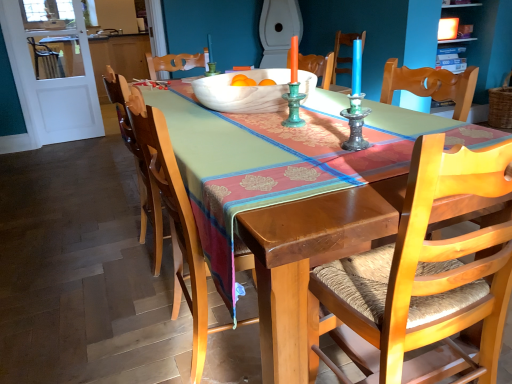
Question: Is white marble bowl at center at the back of white glossy toilet at upper center?

Choices:
 (A) yes
 (B) no

Answer: (B)

Question: Is white glossy toilet at upper center bigger than white marble bowl at center?

Choices:
 (A) yes
 (B) no

Answer: (A)

Question: From a real-world perspective, does white glossy toilet at upper center stand above white marble bowl at center?

Choices:
 (A) no
 (B) yes

Answer: (B)

Question: From the image's perspective, does white glossy toilet at upper center appear higher than white marble bowl at center?

Choices:
 (A) no
 (B) yes

Answer: (B)

Question: Considering the relative sizes of white glossy toilet at upper center and white marble bowl at center in the image provided, is white glossy toilet at upper center shorter than white marble bowl at center?

Choices:
 (A) yes
 (B) no

Answer: (B)

Question: From their relative heights in the image, would you say wooden chair with woven seat at center, which ranks as the first chair in left-to-right order, is taller or shorter than white marble bowl at center?

Choices:
 (A) short
 (B) tall

Answer: (B)

Question: From a real-world perspective, relative to white marble bowl at center, is wooden chair with woven seat at center, which ranks as the first chair in left-to-right order, vertically above or below?

Choices:
 (A) below
 (B) above

Answer: (A)

Question: Is wooden chair with woven seat at center, which ranks as the first chair in left-to-right order, inside the boundaries of white marble bowl at center, or outside?

Choices:
 (A) inside
 (B) outside

Answer: (B)

Question: Looking at the image, does wooden chair with woven seat at center, which ranks as the first chair in left-to-right order, seem bigger or smaller compared to white marble bowl at center?

Choices:
 (A) small
 (B) big

Answer: (B)

Question: Is white marble bowl at center taller or shorter than wooden chair with woven seat at center, which ranks as the first chair in left-to-right order?

Choices:
 (A) short
 (B) tall

Answer: (A)

Question: Is white marble bowl at center bigger or smaller than wooden chair with woven seat at center, the second chair from the right?

Choices:
 (A) big
 (B) small

Answer: (B)

Question: Would you say white marble bowl at center is inside or outside wooden chair with woven seat at center, which ranks as the first chair in left-to-right order?

Choices:
 (A) inside
 (B) outside

Answer: (B)

Question: Looking at their shapes, would you say white marble bowl at center is wider or thinner than wooden chair with woven seat at center, which ranks as the first chair in left-to-right order?

Choices:
 (A) thin
 (B) wide

Answer: (B)

Question: Is point (493, 241) positioned closer to the camera than point (212, 269)?

Choices:
 (A) farther
 (B) closer

Answer: (B)

Question: Based on their positions, is wooden chair with woven seat at center, which is the 1th chair in right-to-left order, located to the left or right of wooden chair with woven seat at center, which ranks as the first chair in left-to-right order?

Choices:
 (A) left
 (B) right

Answer: (B)